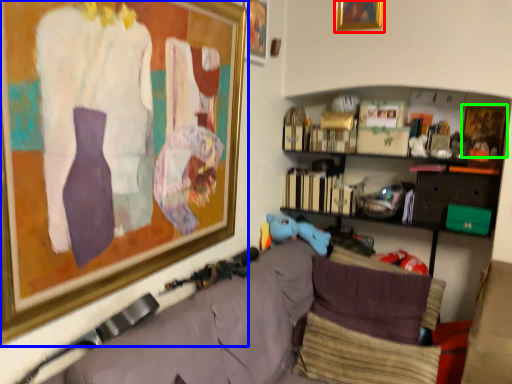
Question: Estimate the real-world distances between objects in this image. Which object is farther from picture frame (highlighted by a red box), picture frame (highlighted by a blue box) or picture frame (highlighted by a green box)?

Choices:
 (A) picture frame
 (B) picture frame

Answer: (A)